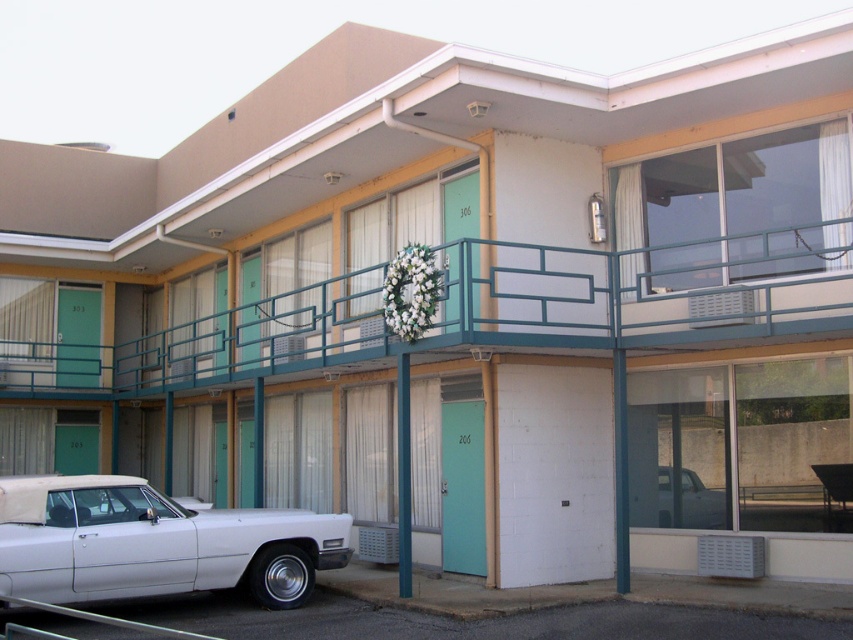
Consider the image. You are a delivery person standing next to the white glossy car at lower left and need to reach the teal metal railing at upper center. Can you walk directly to it without crossing any obstacles?

The distance between the teal metal railing at upper center and the white glossy car at lower left is 14.29 feet. Since there are no obstacles mentioned in the scene description, you can walk directly to it.

You are a delivery person trying to park your white glossy truck at lower right near the motel entrance. There is a white glossy car at lower left in the way. Can you maneuver around it to park your truck?

The white glossy car at lower left is positioned under the white glossy truck at lower right, which means the truck is above the car. Since the car is below, it is blocking the path. You will need to move the car out of the way before parking the truck.

You are standing in front of the motel building and need to determine which object is taller between the teal metal railing at upper center and the white glossy truck at lower right. Based on the scene, which one is taller?

The teal metal railing at upper center is taller than the white glossy truck at lower right.